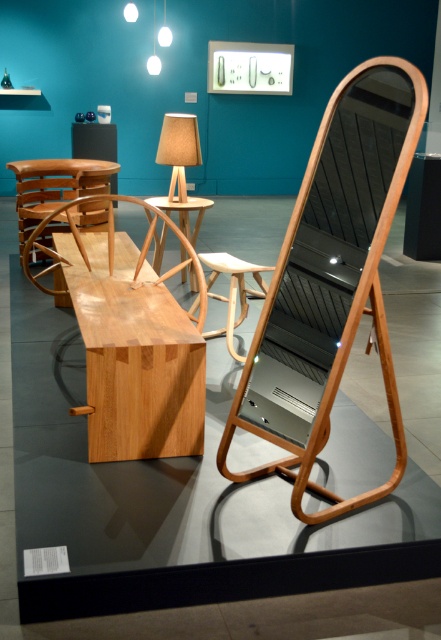
Is natural wood bench at center wider than wooden table at center?

Correct, the width of natural wood bench at center exceeds that of wooden table at center.

Does point (78, 305) come farther from viewer compared to point (189, 196)?

No.

Locate an element on the screen. This screenshot has width=441, height=640. natural wood bench at center is located at coordinates (133, 355).

Between beige fabric lampshade at center and wooden table at center, which one appears on the left side from the viewer's perspective?

Positioned to the left is beige fabric lampshade at center.

Which is in front, point (168, 116) or point (175, 202)?

Positioned in front is point (168, 116).

You are a GUI agent. You are given a task and a screenshot of the screen. Output one action in this format:
    pyautogui.click(x=<x>, y=<y>)
    Task: Click on the beige fabric lampshade at center
    
    Given the screenshot: What is the action you would take?
    pyautogui.click(x=179, y=148)

Between natural wood rocking chair at center and beige fabric lampshade at center, which one appears on the right side from the viewer's perspective?

Positioned to the right is natural wood rocking chair at center.

Between natural wood rocking chair at center and beige fabric lampshade at center, which one has less height?

With less height is beige fabric lampshade at center.

Is point (275, 419) positioned before point (187, 160)?

Yes, point (275, 419) is closer to viewer.

Where is `natural wood rocking chair at center`? This screenshot has width=441, height=640. natural wood rocking chair at center is located at coordinates (331, 280).